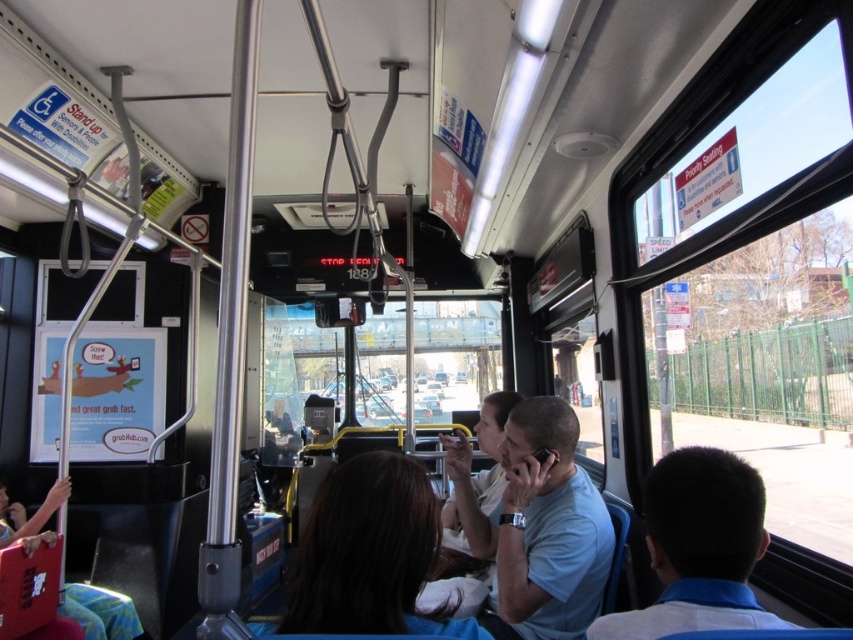
Question: Which point is closer to the camera taking this photo?

Choices:
 (A) (378, 474)
 (B) (596, 582)

Answer: (A)

Question: Which of the following is the closest to the observer?

Choices:
 (A) dark blue shirt at right
 (B) light blue t-shirt at center
 (C) brown hair at center

Answer: (A)

Question: Does brown hair at center appear on the right side of dark blue shirt at right?

Choices:
 (A) no
 (B) yes

Answer: (A)

Question: Considering the relative positions of brown hair at center and light blue t-shirt at center in the image provided, where is brown hair at center located with respect to light blue t-shirt at center?

Choices:
 (A) left
 (B) right

Answer: (A)

Question: Considering the real-world distances, which object is farthest from the dark blue shirt at right?

Choices:
 (A) light blue t-shirt at center
 (B) brown hair at center

Answer: (A)

Question: Is brown hair at center thinner than dark blue shirt at right?

Choices:
 (A) yes
 (B) no

Answer: (B)